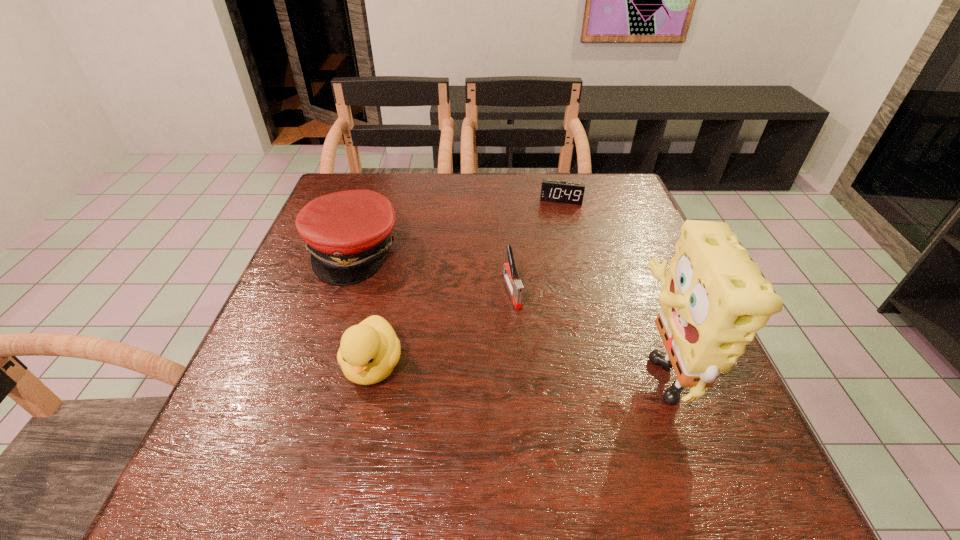
I want to click on vacant space on the desktop that is between the duck and the tallest object and is positioned on the handle side of the stapler, so click(x=544, y=367).

This screenshot has height=540, width=960. I want to click on vacant spot on the desktop that is between the duck and the tallest object and is positioned on the front-facing side of the cap, so click(525, 367).

This screenshot has width=960, height=540. Identify the location of free space on the desktop that is between the duck and the sponge and is positioned on the front-facing side of the farthest object. (539, 367).